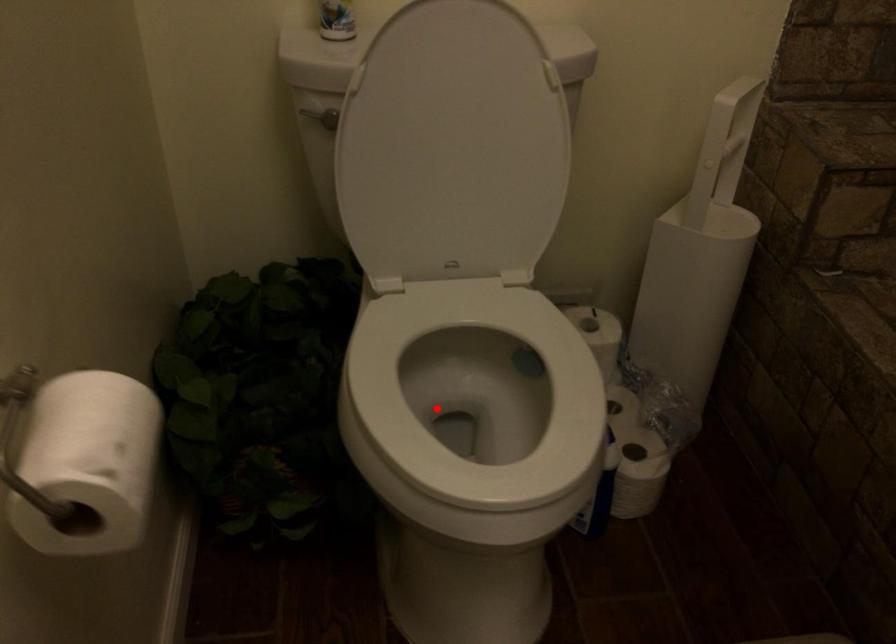
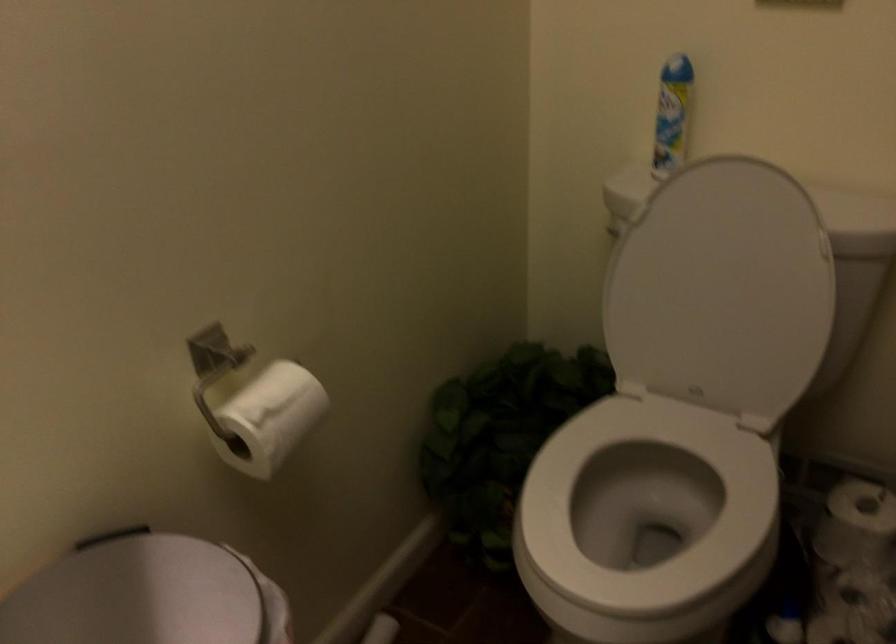
Locate, in the second image, the point that corresponds to the highlighted location in the first image.

(645, 516)